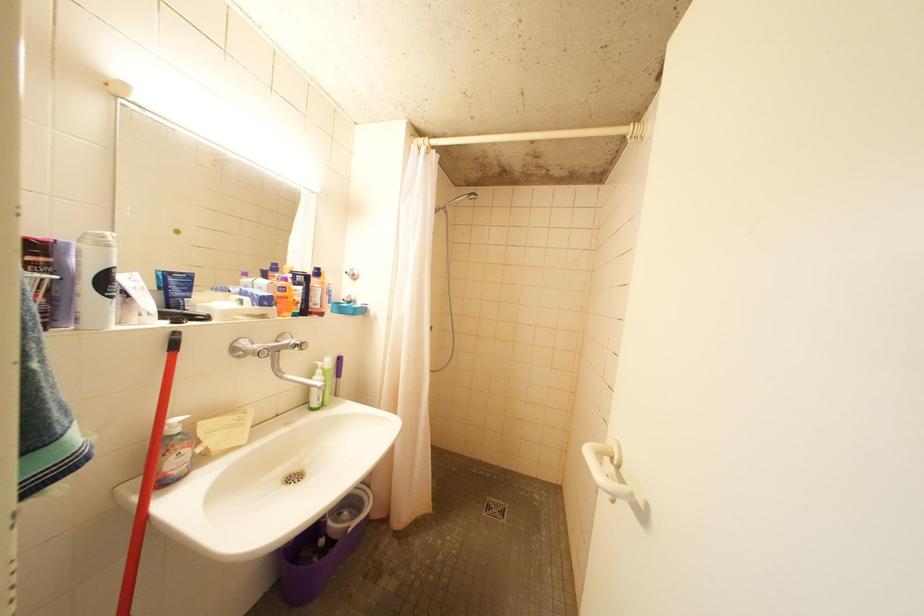
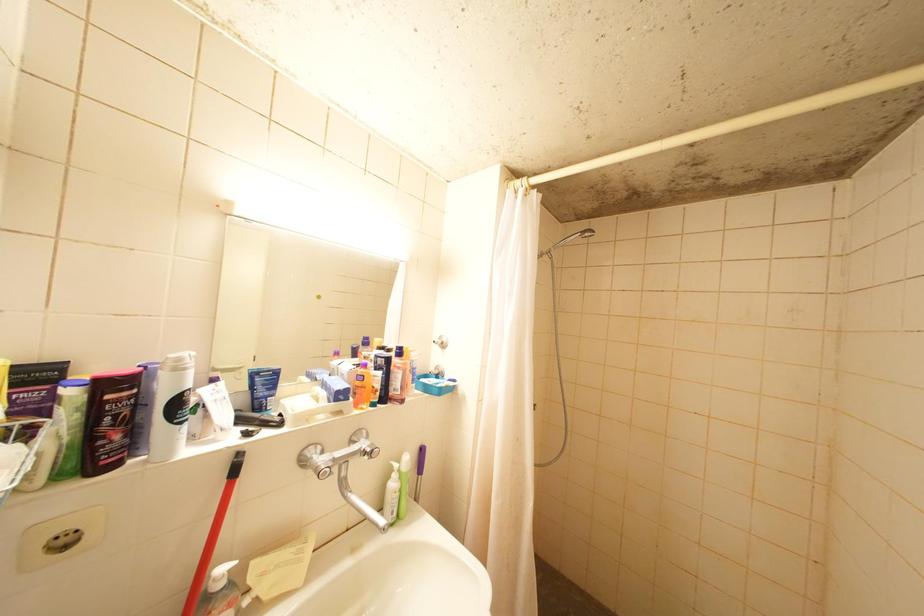
Question: The first image is from the beginning of the video and the second image is from the end. How did the camera likely rotate when shooting the video?

Choices:
 (A) Left
 (B) Right
 (C) Up
 (D) Down

Answer: (A)